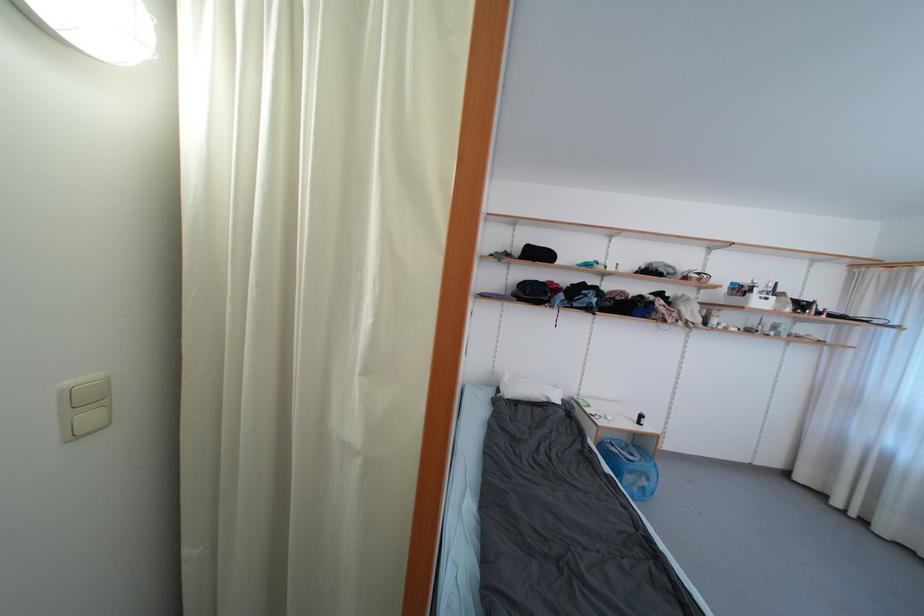
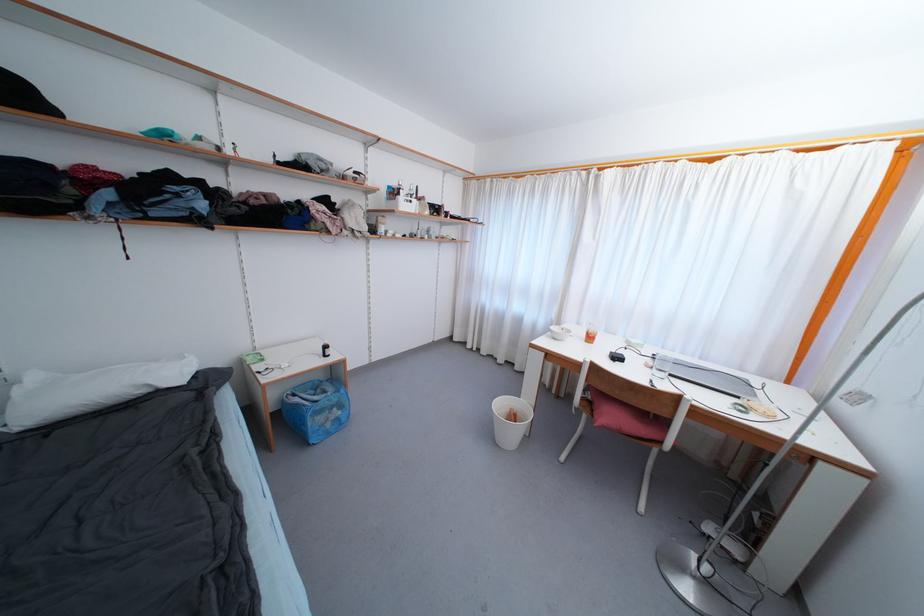
In the second image, find the point that corresponds to (x=646, y=419) in the first image.

(330, 350)